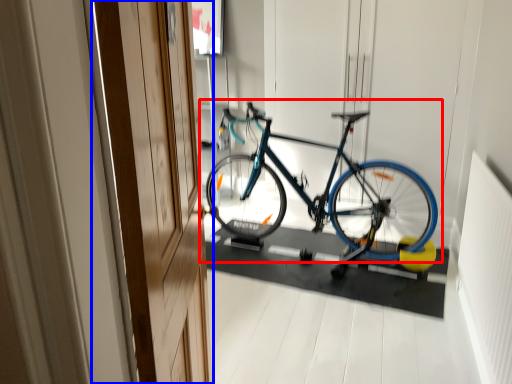
Question: Which object is closer to the camera taking this photo, bicycle (highlighted by a red box) or door (highlighted by a blue box)?

Choices:
 (A) bicycle
 (B) door

Answer: (B)